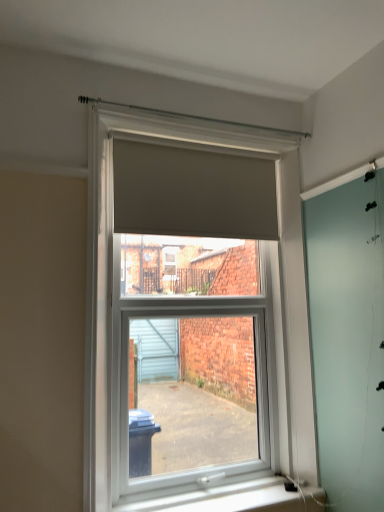
Question: Considering the relative sizes of matte gray roller blind at center and matte gray blind at upper center in the image provided, is matte gray roller blind at center taller than matte gray blind at upper center?

Choices:
 (A) no
 (B) yes

Answer: (B)

Question: Does matte gray roller blind at center come in front of matte gray blind at upper center?

Choices:
 (A) no
 (B) yes

Answer: (B)

Question: From the image's perspective, is matte gray roller blind at center on top of matte gray blind at upper center?

Choices:
 (A) no
 (B) yes

Answer: (A)

Question: Is matte gray roller blind at center far from matte gray blind at upper center?

Choices:
 (A) no
 (B) yes

Answer: (A)

Question: Is matte gray roller blind at center positioned behind matte gray blind at upper center?

Choices:
 (A) yes
 (B) no

Answer: (B)

Question: Is matte gray roller blind at center at the right side of matte gray blind at upper center?

Choices:
 (A) no
 (B) yes

Answer: (B)

Question: Is matte gray blind at upper center positioned with its back to matte gray roller blind at center?

Choices:
 (A) yes
 (B) no

Answer: (A)

Question: Could you tell me if matte gray blind at upper center is turned towards matte gray roller blind at center?

Choices:
 (A) yes
 (B) no

Answer: (A)

Question: Is matte gray blind at upper center not inside matte gray roller blind at center?

Choices:
 (A) no
 (B) yes

Answer: (A)

Question: From a real-world perspective, is matte gray blind at upper center positioned under matte gray roller blind at center based on gravity?

Choices:
 (A) no
 (B) yes

Answer: (A)

Question: From the image's perspective, is matte gray blind at upper center beneath matte gray roller blind at center?

Choices:
 (A) yes
 (B) no

Answer: (B)

Question: From a real-world perspective, does matte gray blind at upper center stand above matte gray roller blind at center?

Choices:
 (A) no
 (B) yes

Answer: (B)

Question: Is matte gray roller blind at center outside of white plastic window sill at lower center?

Choices:
 (A) no
 (B) yes

Answer: (B)